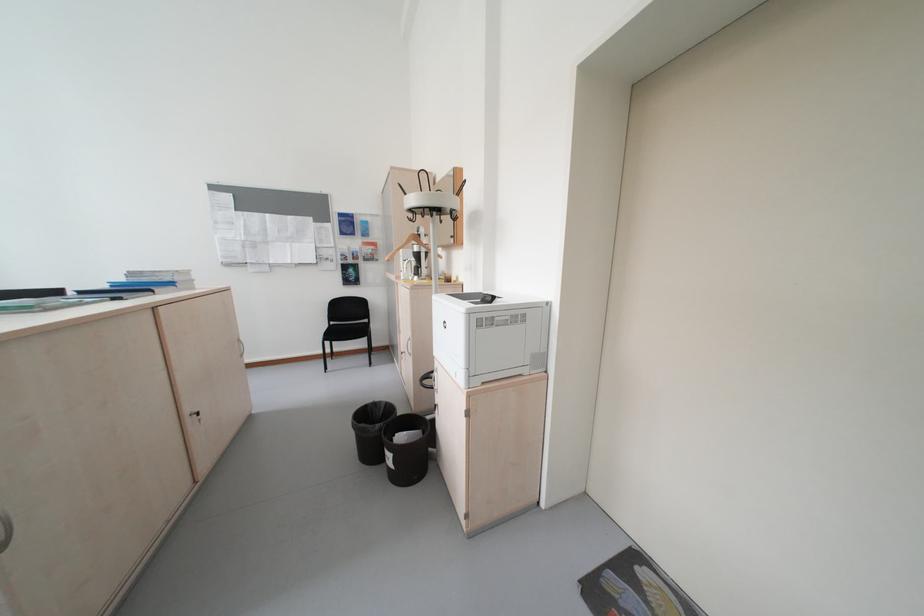
Identify the location of cabinet door handle. [195, 416].